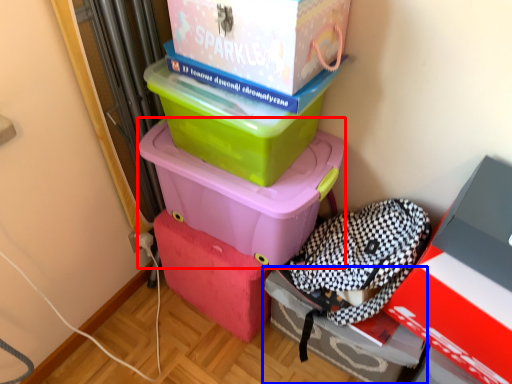
Question: Which object is further to the camera taking this photo, box (highlighted by a red box) or box (highlighted by a blue box)?

Choices:
 (A) box
 (B) box

Answer: (B)